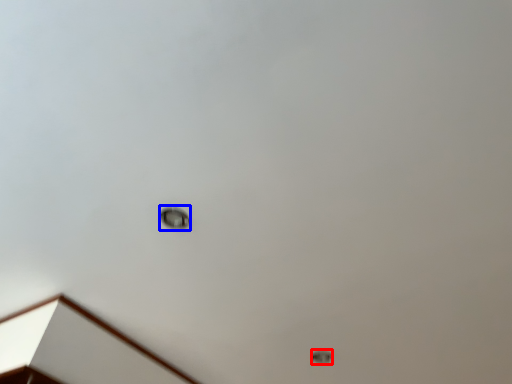
Question: Which object is closer to the camera taking this photo, lamp (highlighted by a red box) or dot (highlighted by a blue box)?

Choices:
 (A) lamp
 (B) dot

Answer: (B)